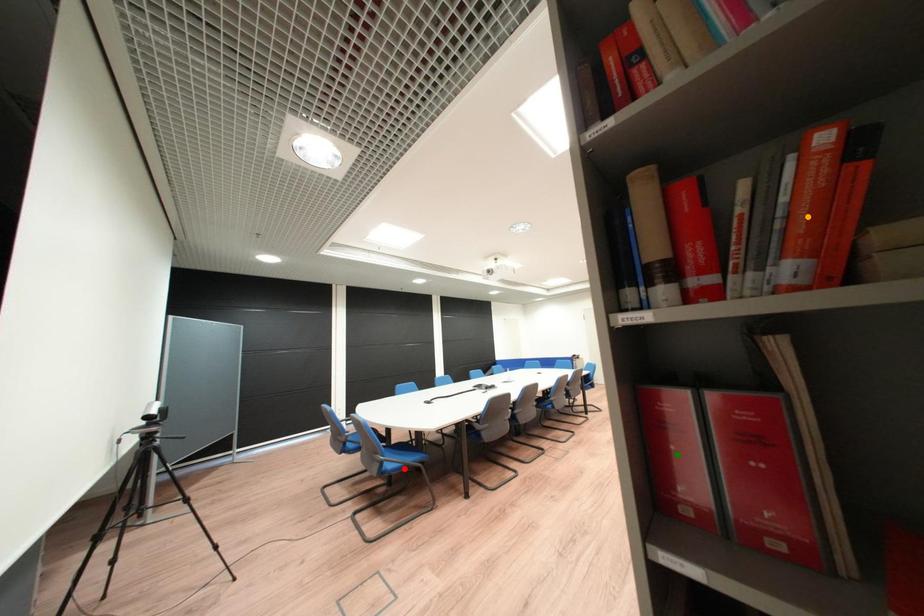
In the scene shown: Order these from nearest to farthest:
orange point | red point | green point

1. orange point
2. green point
3. red point